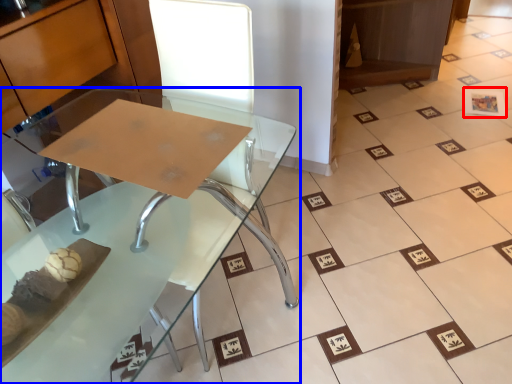
Question: Among these objects, which one is nearest to the camera, square (highlighted by a red box) or table (highlighted by a blue box)?

Choices:
 (A) square
 (B) table

Answer: (B)